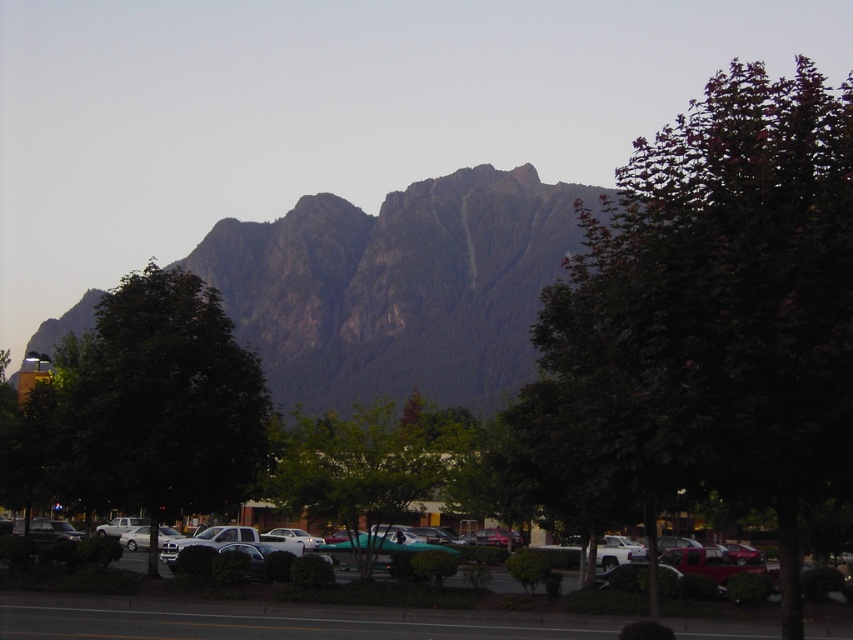
Measure the distance between point (198, 483) and camera.

Point (198, 483) is 92.35 feet from camera.

Is point (109, 458) positioned in front of point (82, 621)?

That is False.

At what (x,y) coordinates should I click in order to perform the action: click on green leafy tree at left. Please return your answer as a coordinate pair (x, y). The width and height of the screenshot is (853, 640). Looking at the image, I should click on (161, 403).

Is green leafy tree at left shorter than green leafy tree at center?

No.

Between green leafy tree at left and green leafy tree at center, which one appears on the right side from the viewer's perspective?

From the viewer's perspective, green leafy tree at center appears more on the right side.

Is point (128, 397) less distant than point (374, 486)?

No, it is behind (374, 486).

Identify the location of green leafy tree at left. (161, 403).

Which is more to the left, green leafy tree at upper right or green leafy tree at center?

Positioned to the left is green leafy tree at center.

The image size is (853, 640). What do you see at coordinates (706, 320) in the screenshot? I see `green leafy tree at upper right` at bounding box center [706, 320].

Describe the element at coordinates (706, 320) in the screenshot. I see `green leafy tree at upper right` at that location.

The image size is (853, 640). I want to click on green leafy tree at upper right, so click(x=706, y=320).